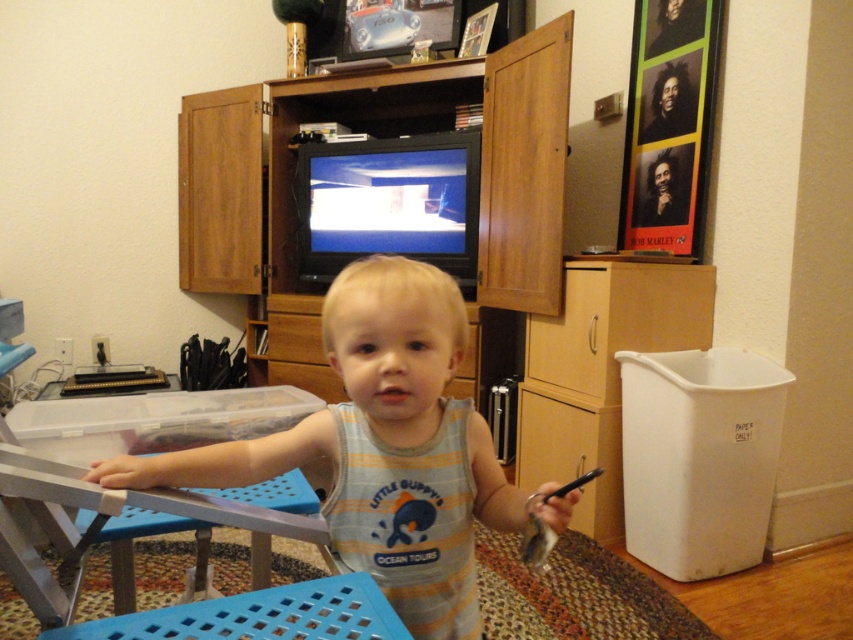
Can you confirm if gray striped tank top at center is smaller than wooden entertainment center at center?

Yes, gray striped tank top at center is smaller than wooden entertainment center at center.

The height and width of the screenshot is (640, 853). What are the coordinates of `gray striped tank top at center` in the screenshot? It's located at (384, 449).